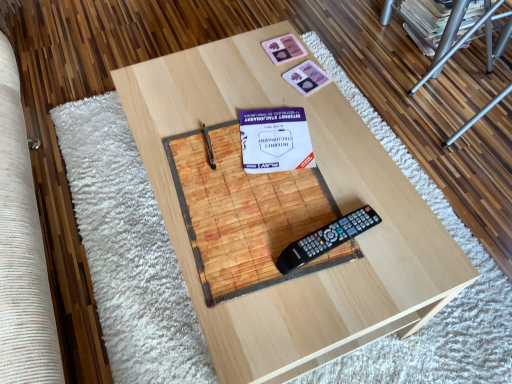
This screenshot has height=384, width=512. Find the location of `vacant area situated to the left side of black plastic remote control at center`. vacant area situated to the left side of black plastic remote control at center is located at coordinates (249, 242).